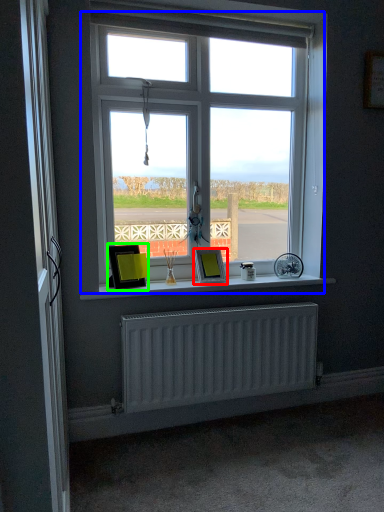
Question: Based on their relative distances, which object is nearer to picture frame (highlighted by a red box)? Choose from window (highlighted by a blue box) and picture frame (highlighted by a green box).

Choices:
 (A) window
 (B) picture frame

Answer: (B)